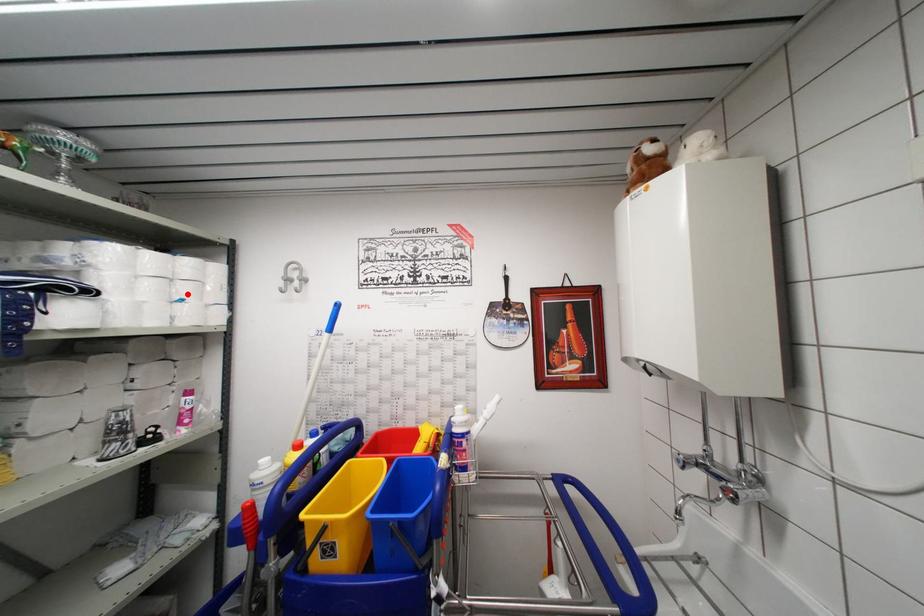
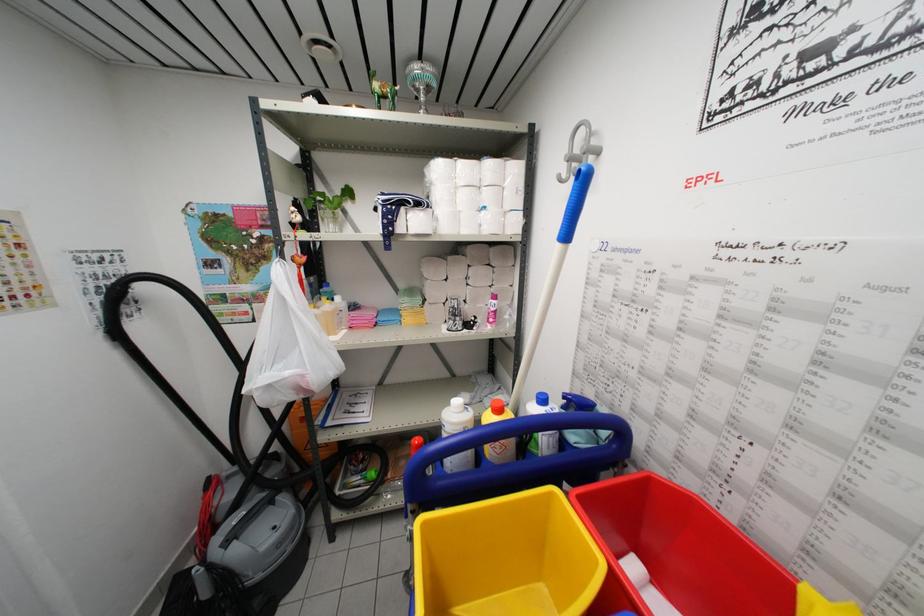
In the second image, find the point that corresponds to the highlighted location in the first image.

(490, 201)